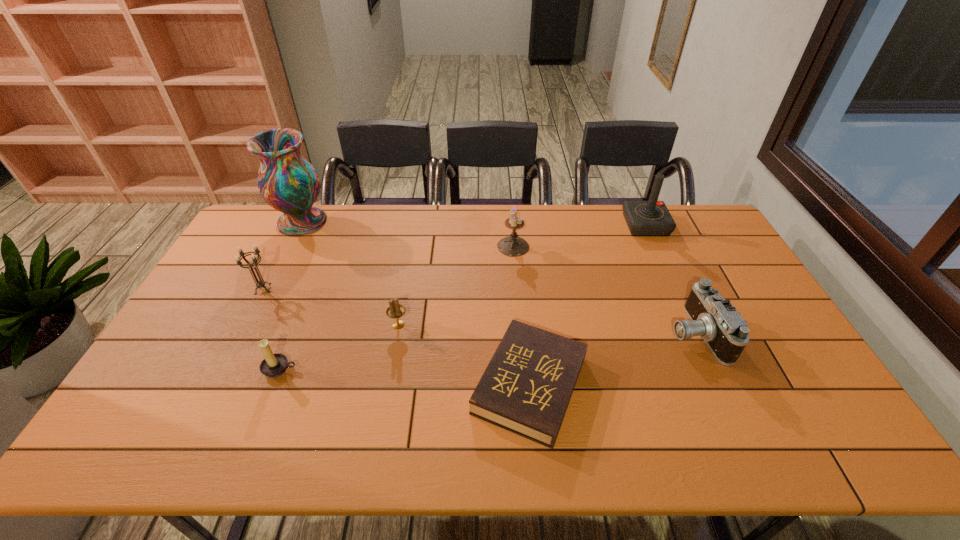
At what (x,y) coordinates should I click in order to perform the action: click on vase. Please return your answer as a coordinate pair (x, y). This screenshot has width=960, height=540. Looking at the image, I should click on (288, 183).

Locate an element on the screen. The width and height of the screenshot is (960, 540). joystick is located at coordinates (644, 218).

The height and width of the screenshot is (540, 960). Find the location of `the rightmost candle holder`. the rightmost candle holder is located at coordinates (513, 245).

This screenshot has width=960, height=540. I want to click on the leftmost candle holder, so (x=261, y=283).

I want to click on the fifth nearest object, so click(x=261, y=283).

Locate an element on the screen. This screenshot has width=960, height=540. the second candle holder from right to left is located at coordinates (395, 310).

Locate an element on the screen. The width and height of the screenshot is (960, 540). the fifth object from right to left is located at coordinates (395, 310).

I want to click on camera, so click(x=714, y=319).

Locate an element on the screen. The height and width of the screenshot is (540, 960). the third candle holder from right to left is located at coordinates (274, 365).

The width and height of the screenshot is (960, 540). I want to click on the shortest object, so click(x=526, y=388).